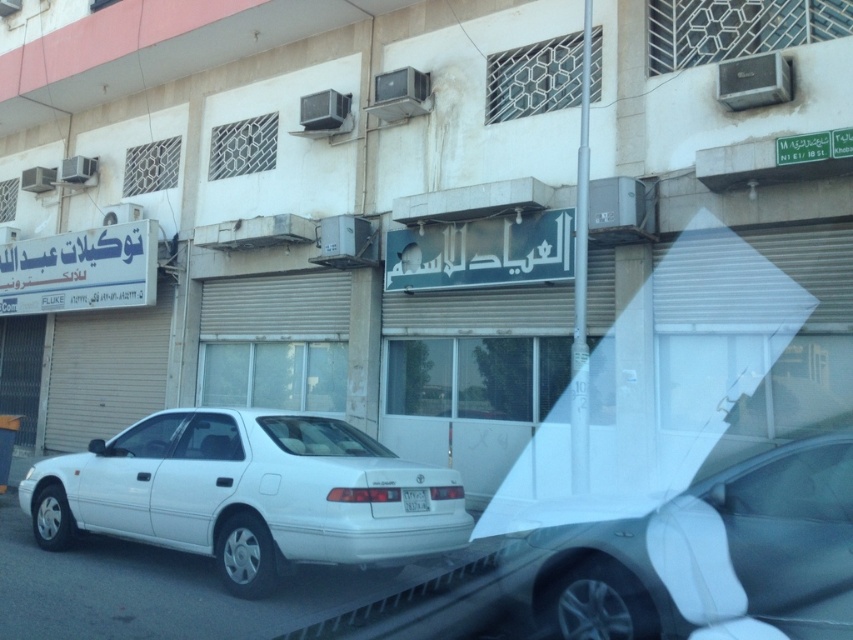
Between white matte car at center and white plastic license plate at center, which one is positioned lower?

Positioned lower is white plastic license plate at center.

Is white matte car at center taller than white plastic license plate at center?

Yes, white matte car at center is taller than white plastic license plate at center.

Locate an element on the screen. The height and width of the screenshot is (640, 853). white matte car at center is located at coordinates (708, 556).

Who is lower down, white matte sedan at lower left or white matte car at center?

white matte sedan at lower left

Is white matte sedan at lower left to the right of white matte car at center from the viewer's perspective?

No, white matte sedan at lower left is not to the right of white matte car at center.

The width and height of the screenshot is (853, 640). Describe the element at coordinates (247, 493) in the screenshot. I see `white matte sedan at lower left` at that location.

In order to click on white matte sedan at lower left in this screenshot , I will do `click(247, 493)`.

Does white matte sedan at lower left lie behind white plastic license plate at center?

No, it is not.

Does white matte sedan at lower left have a larger size compared to white plastic license plate at center?

Correct, white matte sedan at lower left is larger in size than white plastic license plate at center.

The height and width of the screenshot is (640, 853). Find the location of `white matte sedan at lower left`. white matte sedan at lower left is located at coordinates (247, 493).